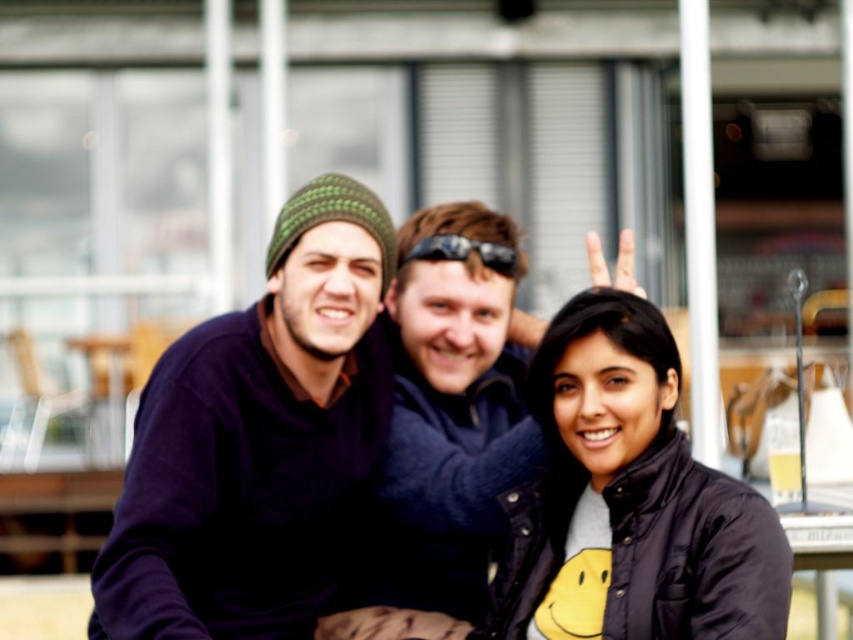
You are a fashion designer observing the three people in the image. You need to determine which item, the matte purple sweater at left or the black rubber sunglasses at center, has a greater width. Based on the scene, which one is wider?

The matte purple sweater at left has a greater width than the black rubber sunglasses at center, as stated in the description.

You are a photographer trying to capture a detailed shot of the dark blue jacket at center and the black rubber sunglasses at center. Which object should you zoom in on to ensure it fills the frame without cropping?

The dark blue jacket at center is bigger than the black rubber sunglasses at center, so you should zoom in on the dark blue jacket at center to ensure it fills the frame without cropping.

You are a fashion designer observing the image. You notice two sweaters at the center of the image, a matte black sweater at center and a dark blue sweater at center. Which one is positioned lower on the person?

The matte black sweater at center is below dark blue sweater at center, so the matte black sweater at center is positioned lower on the person.